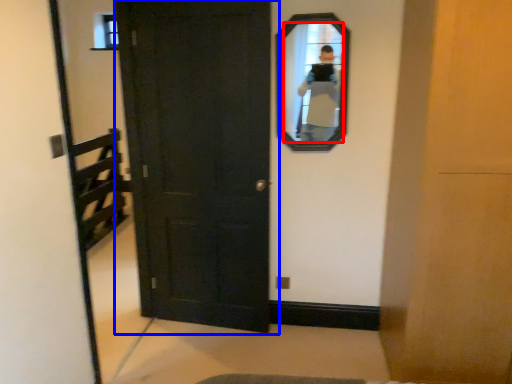
Question: Which of the following is the closest to the observer, mirror (highlighted by a red box) or door (highlighted by a blue box)?

Choices:
 (A) mirror
 (B) door

Answer: (B)